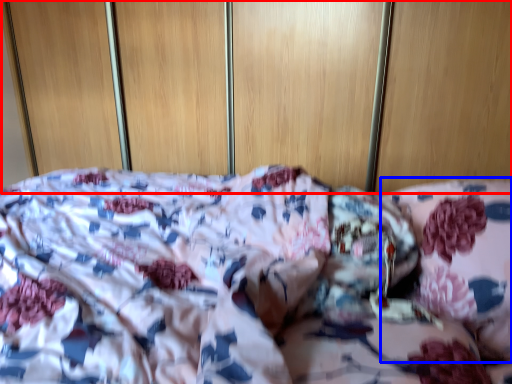
Question: Which object appears closest to the camera in this image, dresser (highlighted by a red box) or pillow (highlighted by a blue box)?

Choices:
 (A) dresser
 (B) pillow

Answer: (B)